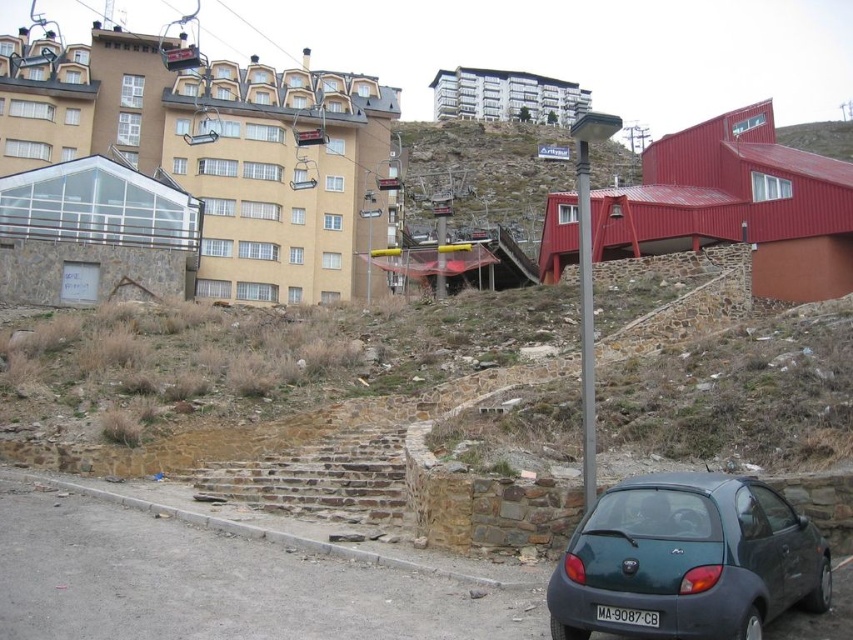
Who is higher up, brown stone stairs at center or metallic pole at center?

Positioned higher is metallic pole at center.

Who is positioned more to the left, brown stone stairs at center or metallic pole at center?

brown stone stairs at center

Who is more distant from viewer, (234, 461) or (581, 140)?

Point (234, 461)

This screenshot has width=853, height=640. Find the location of `brown stone stairs at center`. brown stone stairs at center is located at coordinates (318, 477).

Does point (262, 467) come in front of point (650, 611)?

No, it is behind (650, 611).

Is the position of brown stone stairs at center less distant than that of black plastic license plate at lower center?

That is False.

At what (x,y) coordinates should I click in order to perform the action: click on brown stone stairs at center. Please return your answer as a coordinate pair (x, y). This screenshot has width=853, height=640. Looking at the image, I should click on click(x=318, y=477).

Measure the distance from metallic pole at center to black plastic license plate at lower center.

metallic pole at center is 12.93 meters away from black plastic license plate at lower center.

Can you confirm if metallic pole at center is positioned to the left of black plastic license plate at lower center?

In fact, metallic pole at center is to the right of black plastic license plate at lower center.

Is point (584, 337) closer to camera compared to point (643, 612)?

No, (584, 337) is behind (643, 612).

The image size is (853, 640). I want to click on metallic pole at center, so click(x=585, y=323).